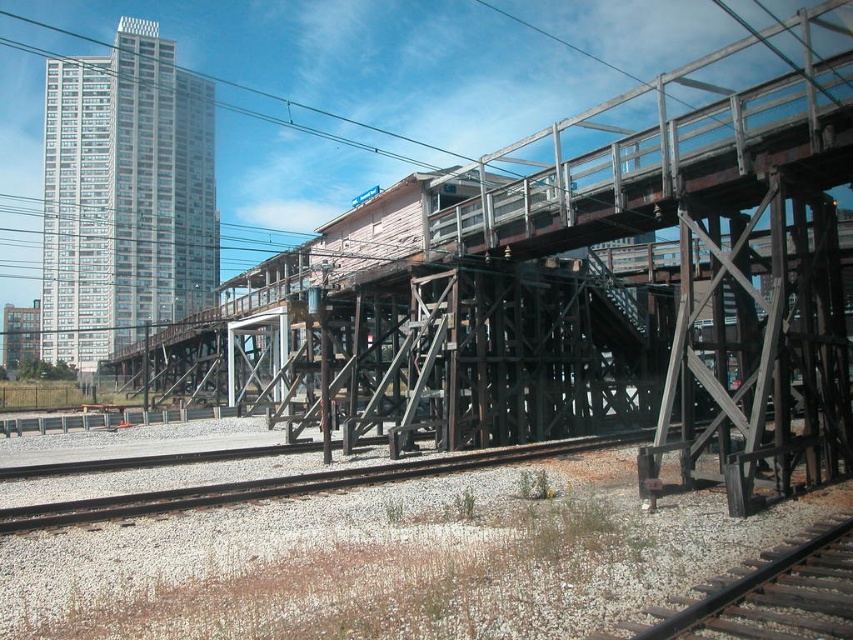
Question: Based on their relative distances, which object is nearer to the brown wooden train track at lower right?

Choices:
 (A) black wire at upper center
 (B) wooden bridge at center

Answer: (B)

Question: Can you confirm if brown wooden train track at lower right is smaller than black wire at upper center?

Choices:
 (A) no
 (B) yes

Answer: (B)

Question: Can you confirm if brown wooden train track at lower right is positioned below black wire at upper center?

Choices:
 (A) no
 (B) yes

Answer: (B)

Question: Does wooden bridge at center appear over black wire at upper center?

Choices:
 (A) yes
 (B) no

Answer: (B)

Question: Which point appears closest to the camera in this image?

Choices:
 (A) (328, 115)
 (B) (691, 289)
 (C) (734, 600)

Answer: (C)

Question: Estimate the real-world distances between objects in this image. Which object is farther from the brown wooden train track at lower right?

Choices:
 (A) wooden bridge at center
 (B) black wire at upper center

Answer: (B)